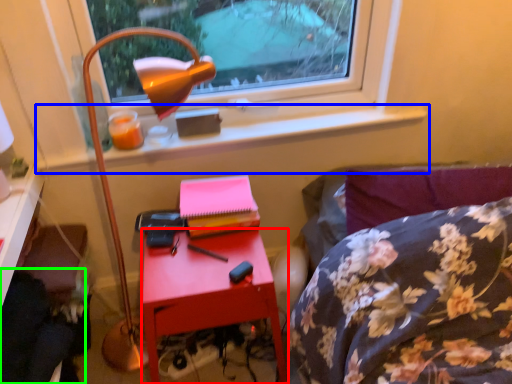
Question: Considering the real-world distances, which object is farthest from nightstand (highlighted by a red box)? window sill (highlighted by a blue box) or swivel chair (highlighted by a green box)?

Choices:
 (A) window sill
 (B) swivel chair

Answer: (A)